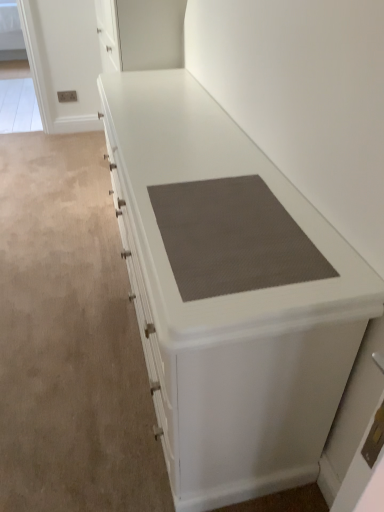
This screenshot has width=384, height=512. I want to click on free space to the left of white textured cabinet at center, so click(61, 296).